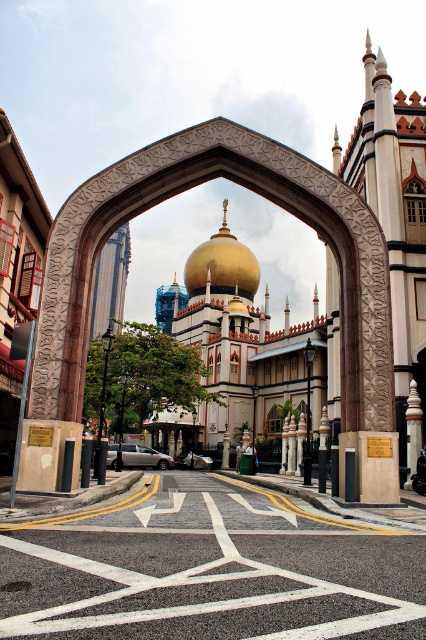
Question: Does gold polished dome at center appear over green fabric person at center?

Choices:
 (A) yes
 (B) no

Answer: (A)

Question: Can you confirm if gold polished dome at center is positioned above green fabric person at center?

Choices:
 (A) yes
 (B) no

Answer: (A)

Question: Can you confirm if gold polished dome at center is positioned to the left of green fabric person at center?

Choices:
 (A) yes
 (B) no

Answer: (A)

Question: Which point appears closest to the camera in this image?

Choices:
 (A) (207, 246)
 (B) (238, 461)

Answer: (B)

Question: Which object appears farthest from the camera in this image?

Choices:
 (A) gold polished dome at center
 (B) green fabric person at center

Answer: (A)